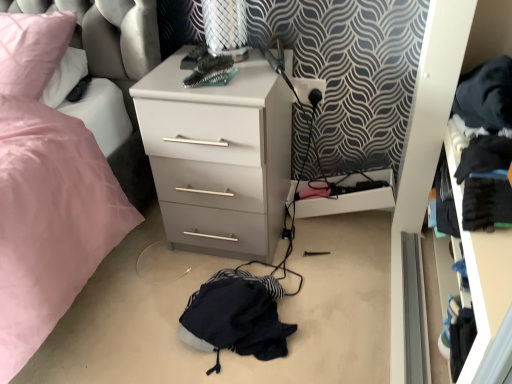
This screenshot has height=384, width=512. Find the location of `vacant space situated above matte gray chest of drawers at center (from a real-world perspective)`. vacant space situated above matte gray chest of drawers at center (from a real-world perspective) is located at coordinates (214, 72).